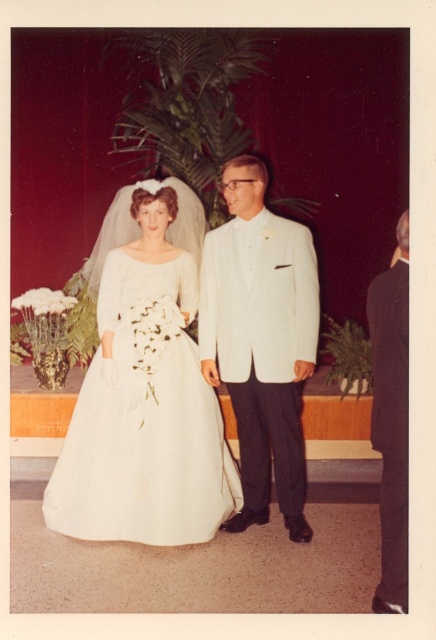
Question: From the image, what is the correct spatial relationship of white satin dress at center in relation to white textured suit at center?

Choices:
 (A) above
 (B) below

Answer: (B)

Question: Which object is positioned closest to the black satin suit at right?

Choices:
 (A) white textured suit at center
 (B) white satin dress at center

Answer: (A)

Question: Which object is the farthest from the white textured suit at center?

Choices:
 (A) black satin suit at right
 (B) white satin dress at center

Answer: (A)

Question: Is white textured suit at center to the right of black satin suit at right from the viewer's perspective?

Choices:
 (A) yes
 (B) no

Answer: (B)

Question: Can you confirm if white satin dress at center is positioned to the right of white textured suit at center?

Choices:
 (A) yes
 (B) no

Answer: (B)

Question: Which object is closer to the camera taking this photo?

Choices:
 (A) white textured suit at center
 (B) black satin suit at right
 (C) white satin dress at center

Answer: (B)